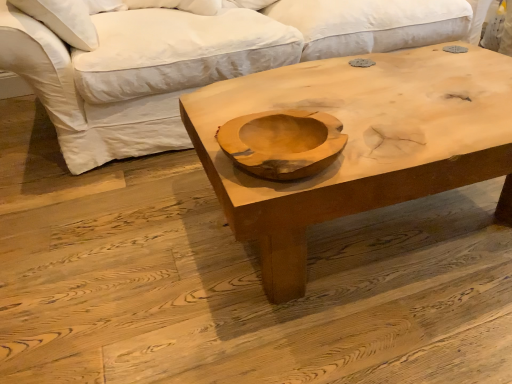
Where is `blank space to the left of natural wood coffee table at center`? blank space to the left of natural wood coffee table at center is located at coordinates (114, 241).